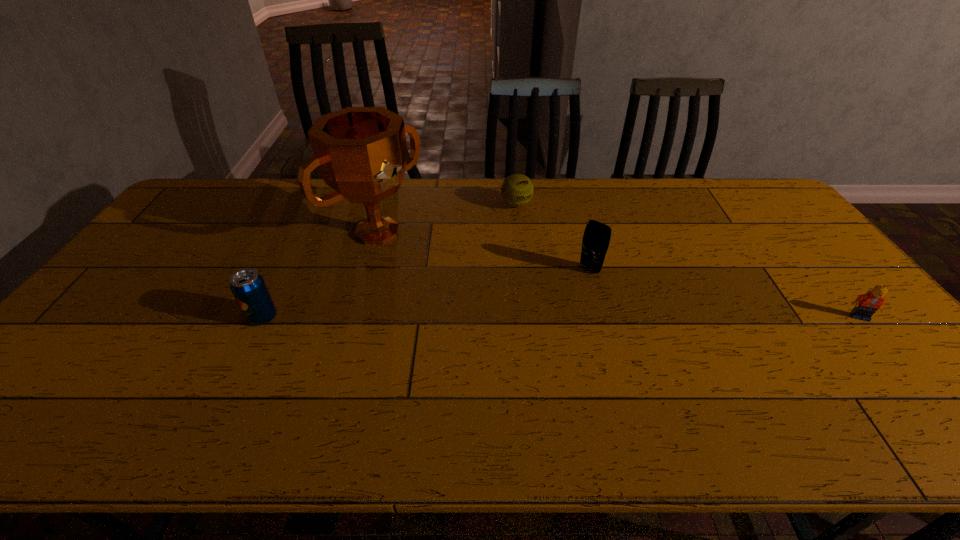
Locate an element on the screen. blank space that satisfies the following two spatial constraints: 1. on the front side of the cellular telephone; 2. on the right side of the softball is located at coordinates (523, 269).